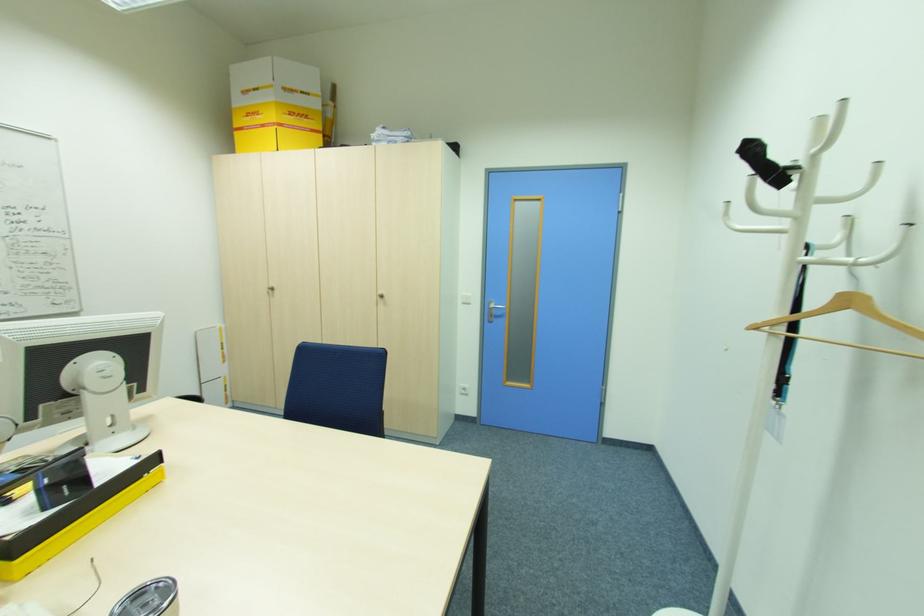
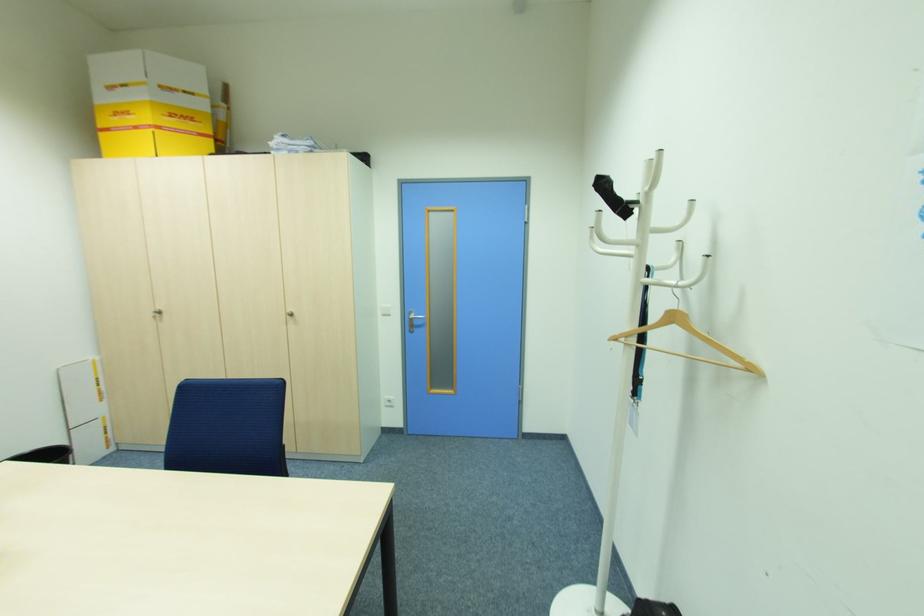
Question: I am providing you with two images of the same scene from different viewpoints. Which of the following objects are not visible in image2?

Choices:
 (A) silver door handle
 (B) wooden clothes hanger
 (C) silver cabinet knob
 (D) none of these

Answer: (D)